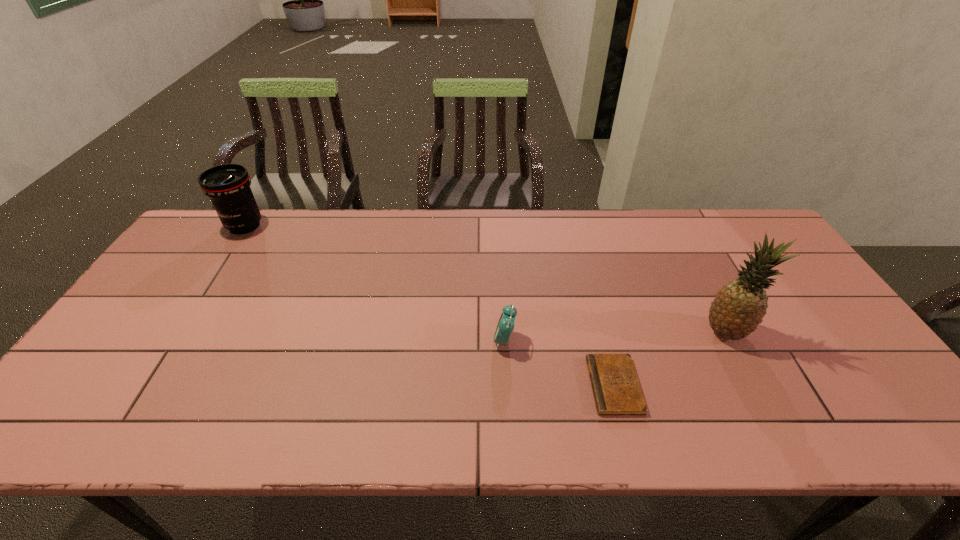
I want to click on free space located 0.380m on the face of the second object from left to right, so click(x=345, y=341).

This screenshot has height=540, width=960. I want to click on vacant space located 0.380m on the face of the second object from left to right, so pyautogui.click(x=345, y=341).

Image resolution: width=960 pixels, height=540 pixels. Identify the location of free space located 0.350m on the face of the second object from left to right. (356, 341).

Where is `vacant space situated 0.070m on the spine side of the shortest object`? This screenshot has width=960, height=540. vacant space situated 0.070m on the spine side of the shortest object is located at coordinates (562, 385).

The height and width of the screenshot is (540, 960). Identify the location of free spot located 0.090m on the spine side of the shortest object. (553, 385).

Locate an element on the screen. blank space located 0.350m on the spine side of the shortest object is located at coordinates (442, 385).

The image size is (960, 540). Find the location of `object at the far edge`. object at the far edge is located at coordinates (228, 185).

Identify the location of object situated at the near edge. The image size is (960, 540). (616, 389).

The height and width of the screenshot is (540, 960). Identify the location of object that is at the left edge. (228, 185).

I want to click on object that is at the far left corner, so click(x=228, y=185).